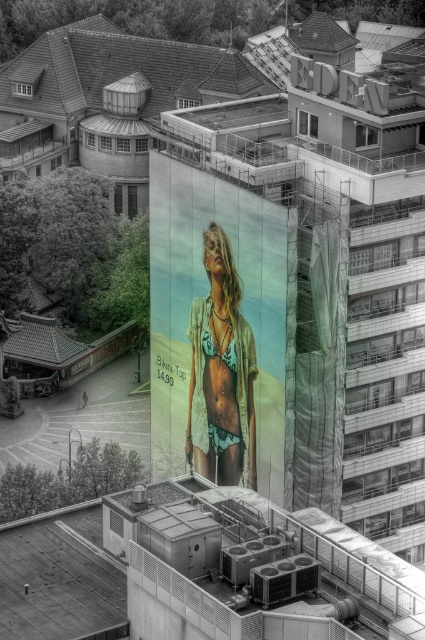
You are standing on the rooftop and want to move from point A to point B. Point A is at coordinates point (190, 218) and point B is at coordinates point (231, 326). Which point should you start from to reach the other without going through obstacles?

You should start from point (231, 326) because point (190, 218) is behind it, so moving from point (231, 326) to point (190, 218) would be the correct path without obstacles.

You are a photographer trying to capture the metallic bikini top at center and the matte green bikini top at center in a single shot. Which one will appear closer to the camera in the photo?

The metallic bikini top at center will appear closer to the camera because it is positioned in front of the matte green bikini top at center.